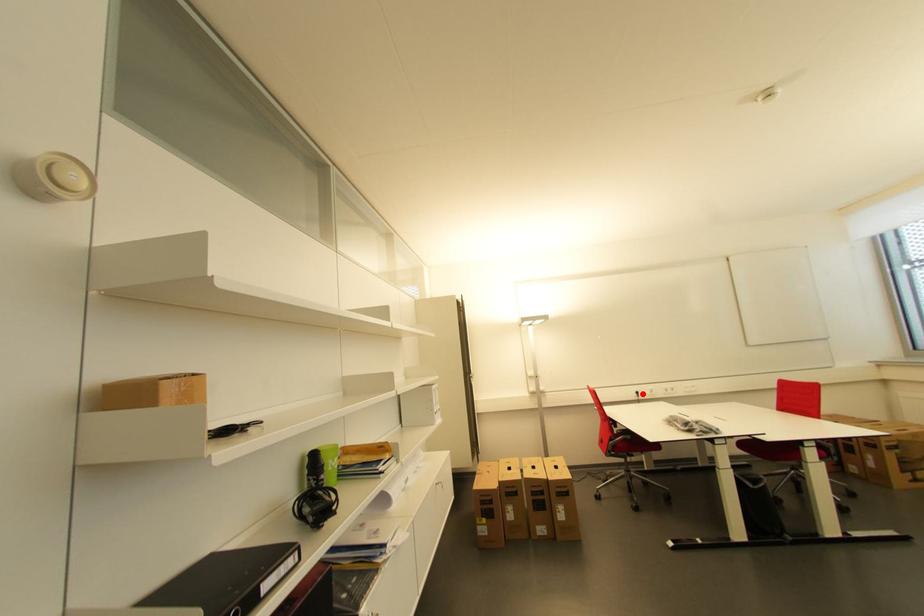
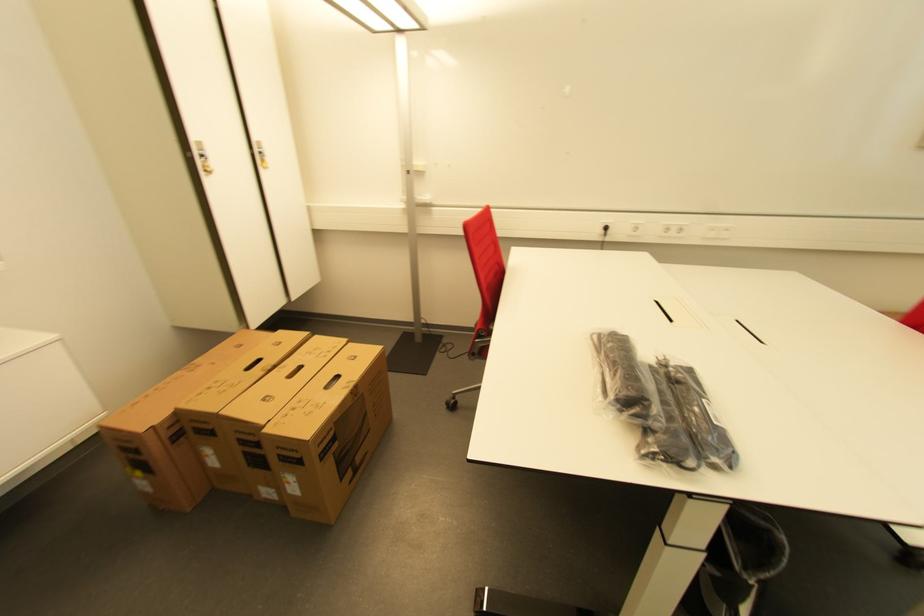
Where in the second image is the point corresponding to the highlighted location from the first image?

(611, 230)